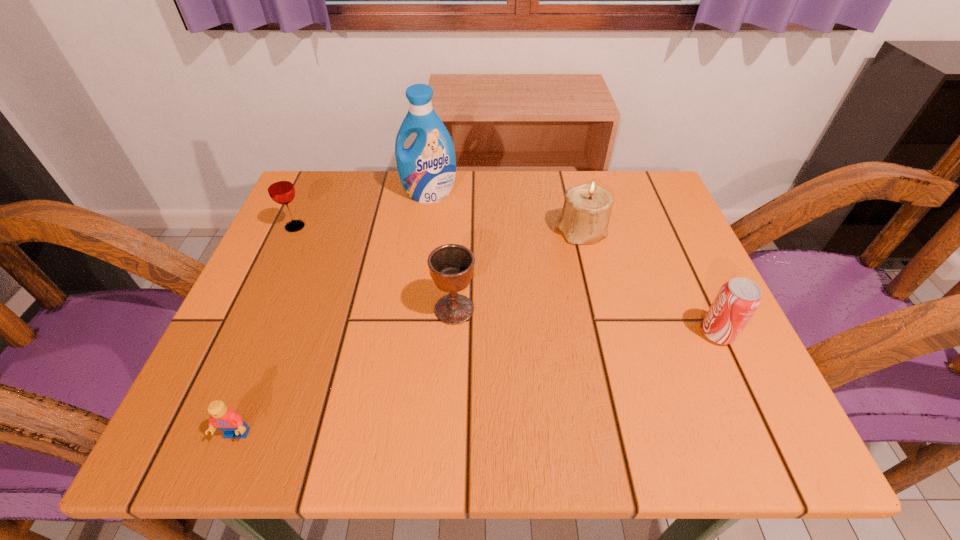
The height and width of the screenshot is (540, 960). What are the coordinates of `blank space located on the right of the leftmost object` in the screenshot? It's located at (404, 227).

At what (x,y) coordinates should I click in order to perform the action: click on vacant space located on the back of the chalice. Please return your answer as a coordinate pair (x, y). Image resolution: width=960 pixels, height=540 pixels. Looking at the image, I should click on (461, 185).

The height and width of the screenshot is (540, 960). Identify the location of free point located on the logo side of the rightmost object. (650, 333).

Where is `vacant space located on the logo side of the rightmost object`? vacant space located on the logo side of the rightmost object is located at coordinates (612, 333).

Identify the location of free space located 0.370m on the logo side of the rightmost object. (494, 333).

The image size is (960, 540). In order to click on detergent present at the far edge in this screenshot , I will do `click(427, 169)`.

Find the location of `candle_holder that is positioned at the far edge`. candle_holder that is positioned at the far edge is located at coordinates (586, 211).

Locate an element on the screen. glass at the far edge is located at coordinates (281, 190).

Find the location of a particular element. Image resolution: width=960 pixels, height=540 pixels. object located in the near edge section of the desktop is located at coordinates (227, 420).

Where is `glass at the left edge`? glass at the left edge is located at coordinates (281, 190).